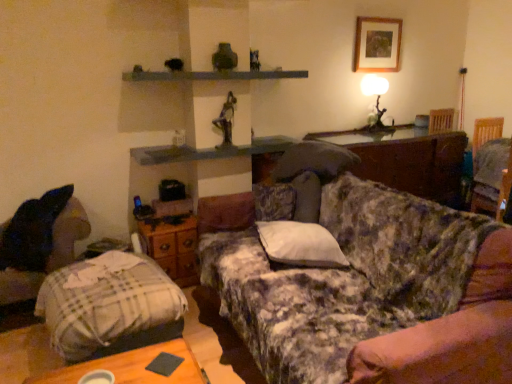
Question: From a real-world perspective, is dark wood swivel chair at right, the first swivel chair viewed from the top, beneath metallic gray shelf at upper center?

Choices:
 (A) yes
 (B) no

Answer: (A)

Question: Is dark wood swivel chair at right, marked as the 1th swivel chair in a back-to-front arrangement, far away from metallic gray shelf at upper center?

Choices:
 (A) no
 (B) yes

Answer: (B)

Question: Does dark wood swivel chair at right, which is counted as the 1th swivel chair, starting from the right, have a lesser width compared to metallic gray shelf at upper center?

Choices:
 (A) yes
 (B) no

Answer: (A)

Question: Does dark wood swivel chair at right, the first swivel chair viewed from the top, have a greater width compared to metallic gray shelf at upper center?

Choices:
 (A) no
 (B) yes

Answer: (A)

Question: Is dark wood swivel chair at right, which is counted as the 1th swivel chair, starting from the right, oriented away from metallic gray shelf at upper center?

Choices:
 (A) no
 (B) yes

Answer: (A)

Question: Is dark wood swivel chair at right, which is counted as the 1th swivel chair, starting from the right, smaller than metallic gray shelf at upper center?

Choices:
 (A) yes
 (B) no

Answer: (B)

Question: Does plaid fabric bedcover at lower left come behind dark wood swivel chair at right, the second swivel chair viewed from the left?

Choices:
 (A) no
 (B) yes

Answer: (A)

Question: Does plaid fabric bedcover at lower left have a lesser width compared to dark wood swivel chair at right, arranged as the second swivel chair when ordered from the bottom?

Choices:
 (A) yes
 (B) no

Answer: (B)

Question: From a real-world perspective, is plaid fabric bedcover at lower left physically above dark wood swivel chair at right, the first swivel chair viewed from the top?

Choices:
 (A) yes
 (B) no

Answer: (B)

Question: Is plaid fabric bedcover at lower left shorter than dark wood swivel chair at right, which is counted as the 1th swivel chair, starting from the right?

Choices:
 (A) no
 (B) yes

Answer: (B)

Question: Could you tell me if plaid fabric bedcover at lower left is facing dark wood swivel chair at right, which is counted as the 1th swivel chair, starting from the right?

Choices:
 (A) no
 (B) yes

Answer: (A)

Question: Can you confirm if plaid fabric bedcover at lower left is positioned to the left of dark wood swivel chair at right, marked as the 1th swivel chair in a back-to-front arrangement?

Choices:
 (A) yes
 (B) no

Answer: (A)

Question: Is fluffy white pillow at right, the first pillow from the right, taller than matte white wood table lamp at upper right?

Choices:
 (A) yes
 (B) no

Answer: (B)